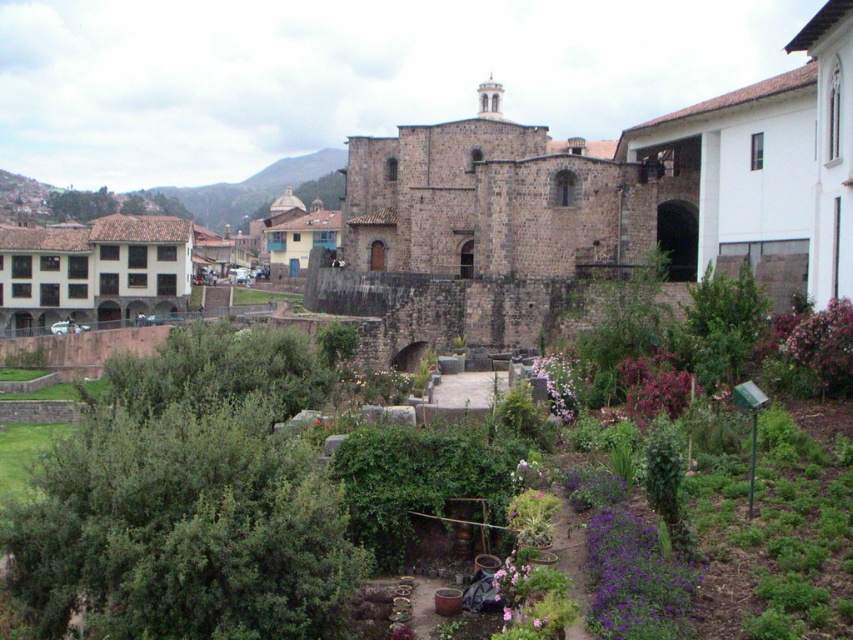
You are standing in the courtyard of the garden and want to take a photo of the brown stone castle at center. Where should you position yourself to capture the castle in the frame?

You should position yourself in the courtyard facing the brown stone castle at center, which is located at coordinates point (486, 228) to ensure it is centered in your photo.

You are standing in the courtyard and see two points marked in the garden. The first point is at coordinate point(86, 564) and the second is at point(251, 179). Which point is closer to you?

Point(86, 564) is in front of point(251, 179), so it is closer to you.

You are standing in the courtyard and want to walk towards the brown stone castle at center. However, there is a brown stone wall at center blocking your path. Can you walk through the wall to reach the castle?

The brown stone wall at center is positioned over brown stone castle at center, meaning the wall is in front of the castle. Since walls are solid structures, you cannot walk through the wall to reach the castle. You would need to go around the wall or find another entrance.